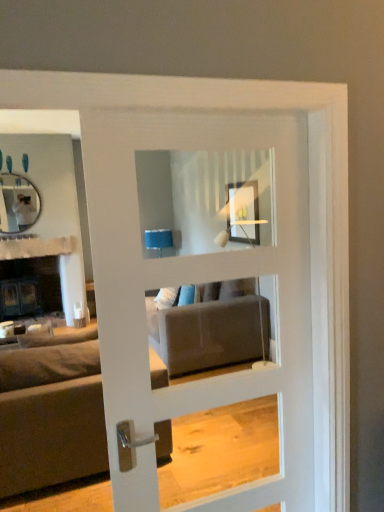
Question: From a real-world perspective, is white glossy door at center beneath dark gray fabric couch at left?

Choices:
 (A) no
 (B) yes

Answer: (A)

Question: Can you confirm if white glossy door at center is taller than dark gray fabric couch at left?

Choices:
 (A) no
 (B) yes

Answer: (B)

Question: Is white glossy door at center facing towards dark gray fabric couch at left?

Choices:
 (A) no
 (B) yes

Answer: (B)

Question: Would you say white glossy door at center is outside dark gray fabric couch at left?

Choices:
 (A) no
 (B) yes

Answer: (B)

Question: From the image's perspective, is white glossy door at center on dark gray fabric couch at left?

Choices:
 (A) yes
 (B) no

Answer: (A)

Question: From a real-world perspective, is white textured fabric at upper left positioned above or below white glossy door at center?

Choices:
 (A) below
 (B) above

Answer: (A)

Question: Considering the relative positions of white textured fabric at upper left and white glossy door at center in the image provided, is white textured fabric at upper left to the left or to the right of white glossy door at center?

Choices:
 (A) right
 (B) left

Answer: (B)

Question: Is white textured fabric at upper left spatially inside white glossy door at center, or outside of it?

Choices:
 (A) outside
 (B) inside

Answer: (A)

Question: Considering their positions, is white textured fabric at upper left located in front of or behind white glossy door at center?

Choices:
 (A) front
 (B) behind

Answer: (B)

Question: Would you say matte black mirror at upper left is to the left or to the right of white glossy door at center in the picture?

Choices:
 (A) left
 (B) right

Answer: (A)

Question: Considering the positions of point (34, 190) and point (235, 394), is point (34, 190) closer or farther from the camera than point (235, 394)?

Choices:
 (A) closer
 (B) farther

Answer: (B)

Question: In terms of height, does matte black mirror at upper left look taller or shorter compared to white glossy door at center?

Choices:
 (A) short
 (B) tall

Answer: (A)

Question: From the image's perspective, is matte black mirror at upper left positioned above or below white glossy door at center?

Choices:
 (A) above
 (B) below

Answer: (A)

Question: Visually, is dark gray fabric couch at left positioned to the left or to the right of white glossy door at center?

Choices:
 (A) left
 (B) right

Answer: (A)

Question: Is dark gray fabric couch at left wider or thinner than white glossy door at center?

Choices:
 (A) thin
 (B) wide

Answer: (B)